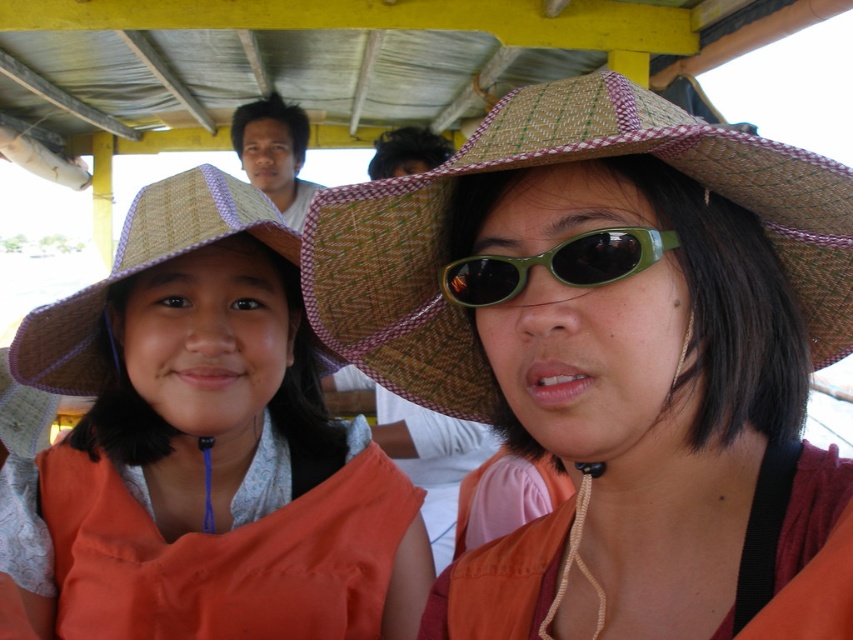
Question: Is matte straw hat at center smaller than brown woven straw hat at center?

Choices:
 (A) no
 (B) yes

Answer: (A)

Question: Based on their relative distances, which object is nearer to the brown woven straw hat at center?

Choices:
 (A) woven straw hat at left
 (B) matte straw hat at center
 (C) green matte sunglasses at center

Answer: (C)

Question: Considering the real-world distances, which object is closest to the green matte sunglasses at center?

Choices:
 (A) matte straw hat at center
 (B) brown woven straw hat at center

Answer: (B)

Question: Which is nearer to the woven straw hat at left?

Choices:
 (A) green matte sunglasses at center
 (B) matte straw hat at center
 (C) brown woven straw hat at center

Answer: (B)

Question: Is matte straw hat at center to the left of brown woven straw hat at center from the viewer's perspective?

Choices:
 (A) no
 (B) yes

Answer: (B)

Question: Does woven straw hat at left appear under green matte sunglasses at center?

Choices:
 (A) no
 (B) yes

Answer: (B)